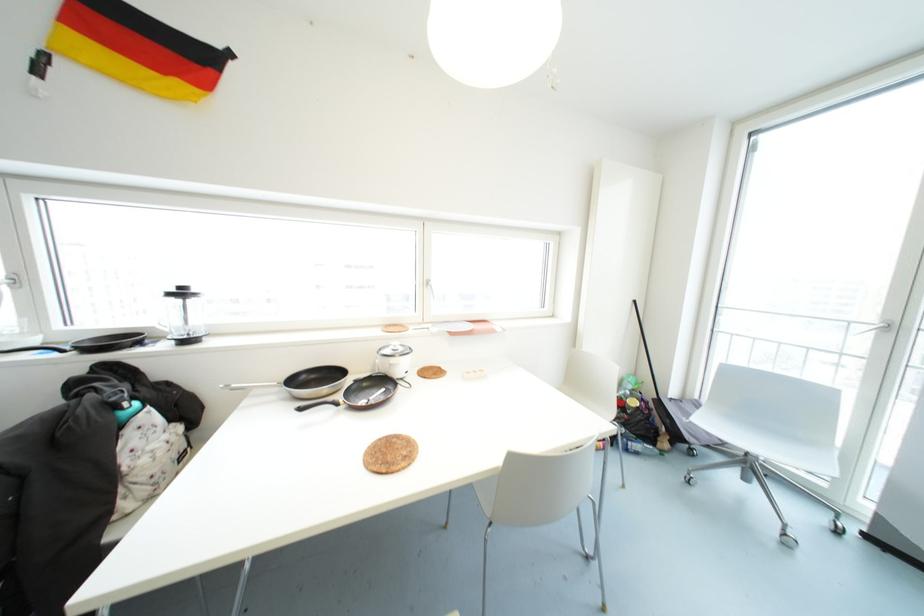
Where is `black blender handle`? Image resolution: width=924 pixels, height=616 pixels. black blender handle is located at coordinates (319, 405).